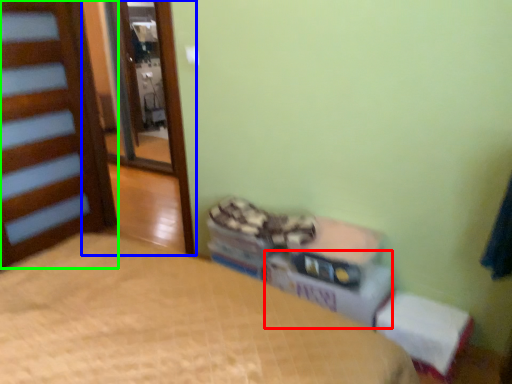
Question: Which is nearer to the cardboard box (highlighted by a red box)? screen door (highlighted by a blue box) or door (highlighted by a green box).

Choices:
 (A) screen door
 (B) door

Answer: (B)